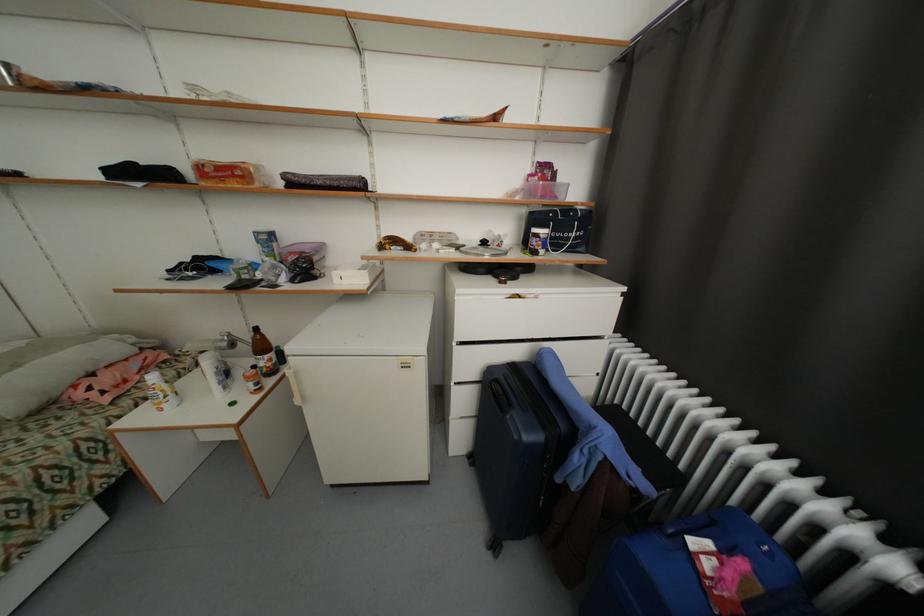
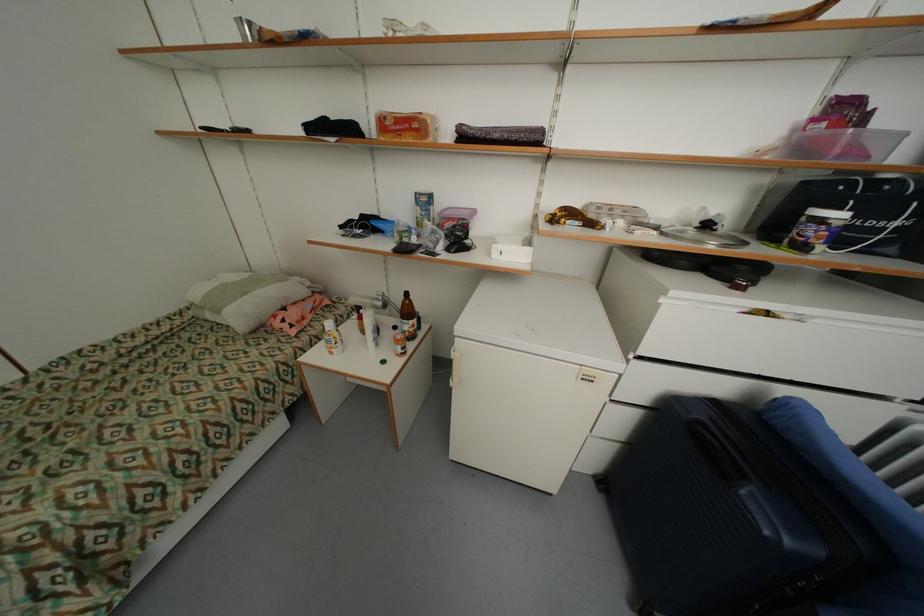
The point at (491, 244) is marked in the first image. Where is the corresponding point in the second image?

(713, 227)